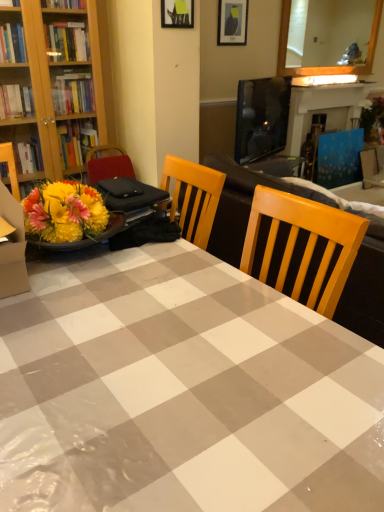
Where is `empty space that is ontop of gray checkered tablecloth at center (from a real-world perspective)`? empty space that is ontop of gray checkered tablecloth at center (from a real-world perspective) is located at coordinates (137, 328).